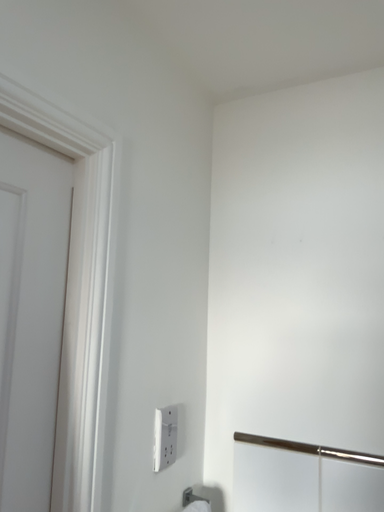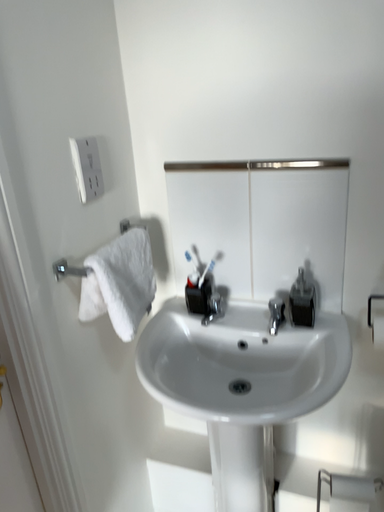
Question: Which way did the camera rotate in the video?

Choices:
 (A) rotated downward
 (B) rotated upward

Answer: (A)